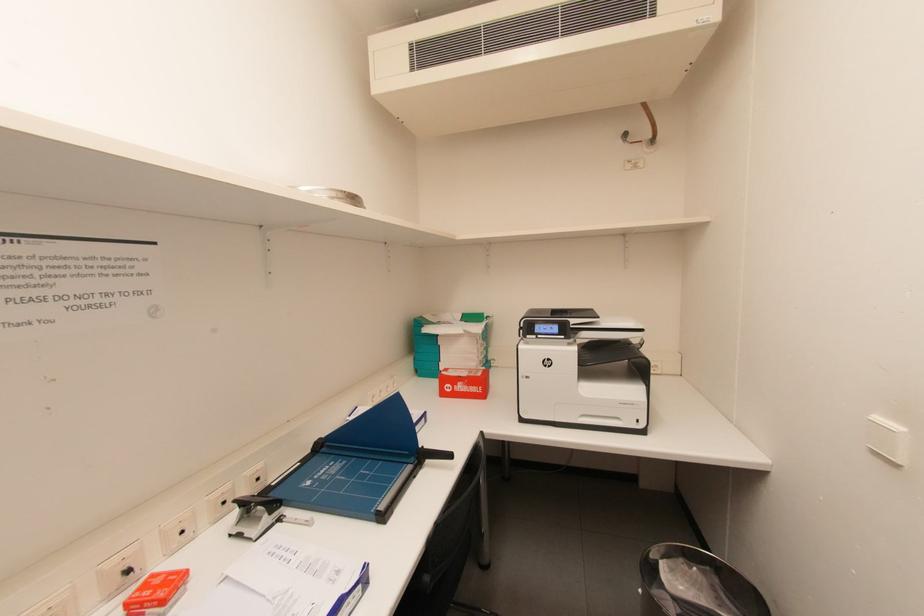
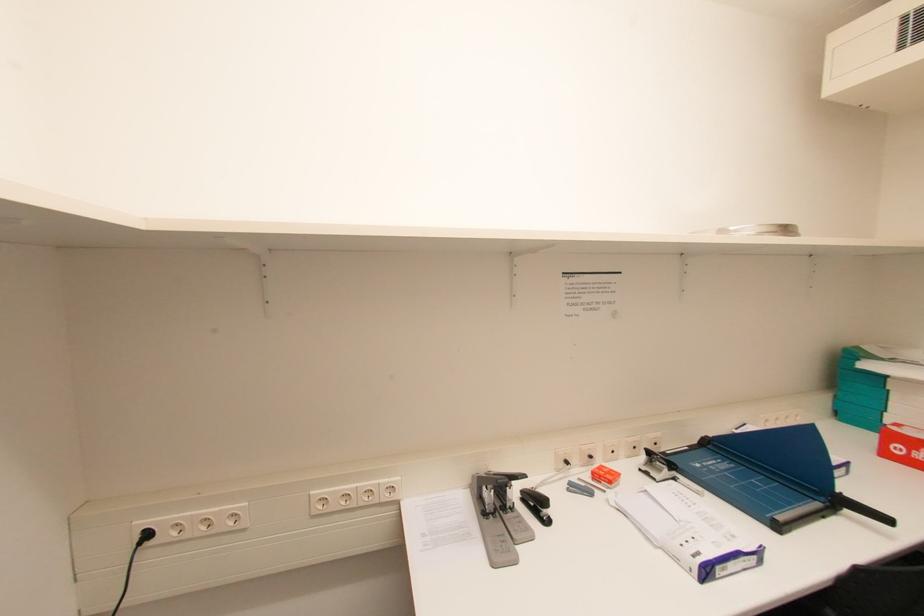
Question: The camera is either moving clockwise (left) or counter-clockwise (right) around the object. The first image is from the beginning of the video and the second image is from the end. Is the camera moving left or right when shooting the video?

Choices:
 (A) Left
 (B) Right

Answer: (B)